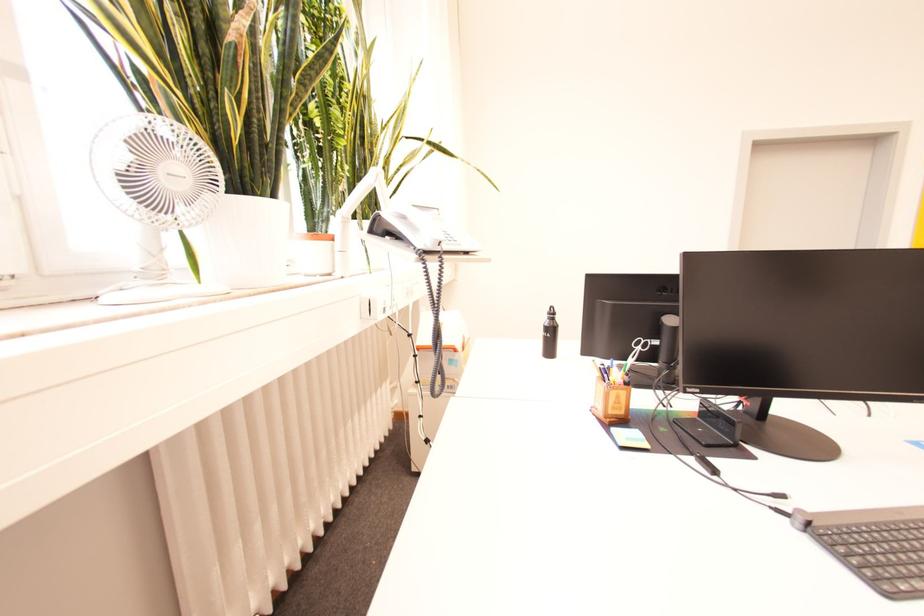
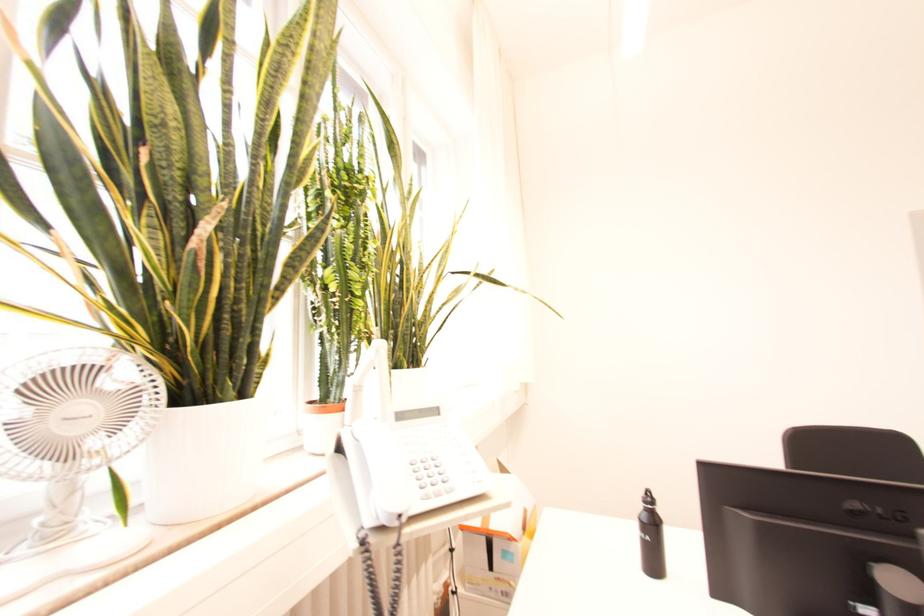
Find the pixel in the second image that matches point 555,315 in the first image.

(651, 503)